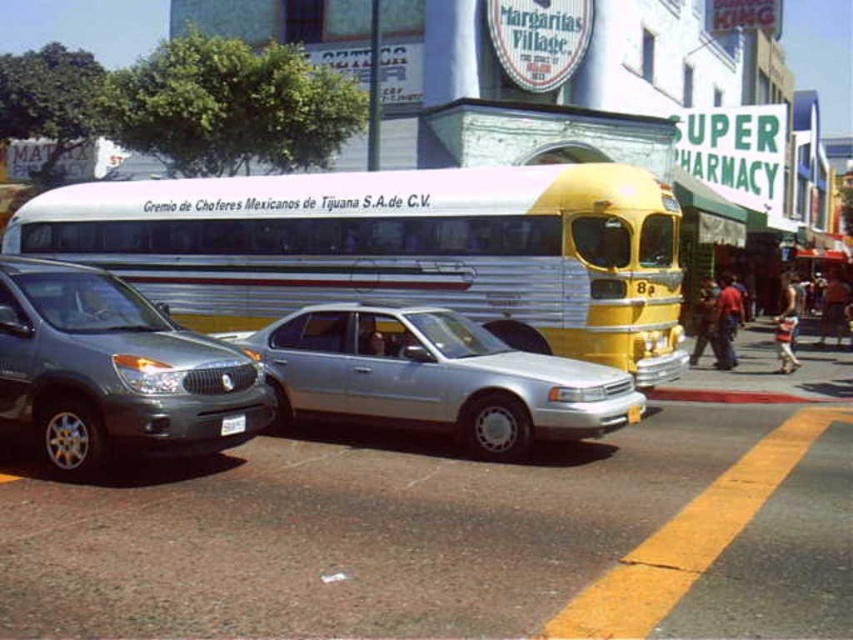
Question: Is silver metallic bus at center to the left of smooth concrete curb at lower right from the viewer's perspective?

Choices:
 (A) yes
 (B) no

Answer: (A)

Question: Which point is farther from the camera taking this photo?

Choices:
 (A) pyautogui.click(x=241, y=426)
 (B) pyautogui.click(x=120, y=413)

Answer: (A)

Question: Which of the following is the closest to the observer?

Choices:
 (A) (241, 419)
 (B) (141, 429)
 (C) (331, 312)

Answer: (B)

Question: Which point is closer to the camera?

Choices:
 (A) (86, 186)
 (B) (235, 428)
 (C) (670, 390)

Answer: (B)

Question: Is satin silver suv at left to the left of smooth concrete curb at lower right from the viewer's perspective?

Choices:
 (A) no
 (B) yes

Answer: (B)

Question: Does silver metallic sedan at center have a larger size compared to smooth concrete curb at lower right?

Choices:
 (A) yes
 (B) no

Answer: (A)